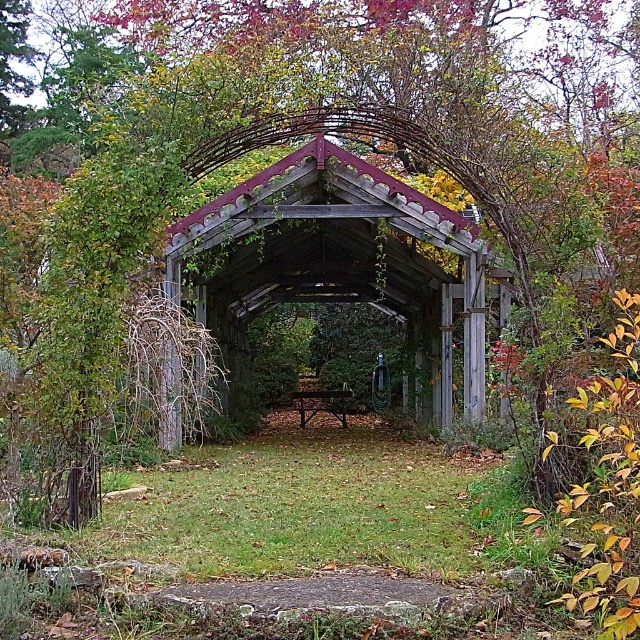
Question: Which point is closer to the camera?

Choices:
 (A) (308, 419)
 (B) (307, 284)

Answer: (B)

Question: Is wooden gazebo at center bigger than wooden park bench at center?

Choices:
 (A) no
 (B) yes

Answer: (B)

Question: Does wooden gazebo at center come in front of wooden park bench at center?

Choices:
 (A) yes
 (B) no

Answer: (A)

Question: Does wooden gazebo at center lie behind wooden park bench at center?

Choices:
 (A) no
 (B) yes

Answer: (A)

Question: Which object appears closest to the camera in this image?

Choices:
 (A) wooden park bench at center
 (B) wooden gazebo at center

Answer: (B)